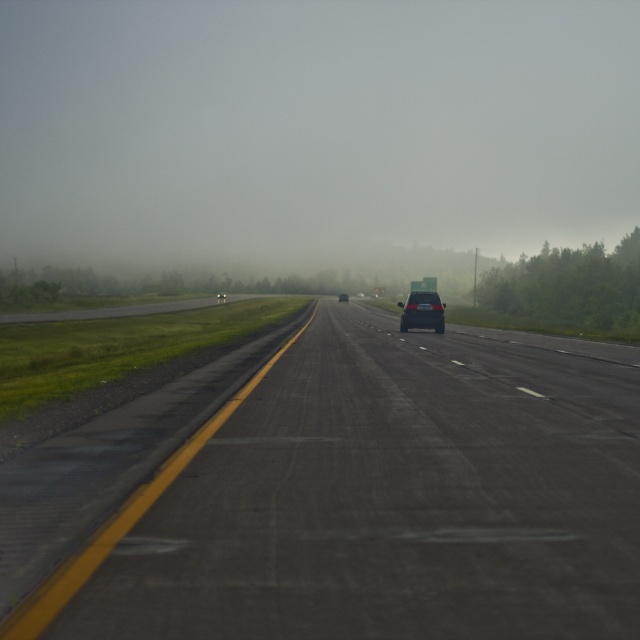
Who is lower down, black asphalt runway at center or satin black suv at center?

Positioned lower is black asphalt runway at center.

Which is in front, point (330, 632) or point (438, 330)?

Positioned in front is point (330, 632).

Identify the location of black asphalt runway at center. (385, 499).

Find the location of a particular element. This screenshot has width=640, height=640. black asphalt runway at center is located at coordinates (385, 499).